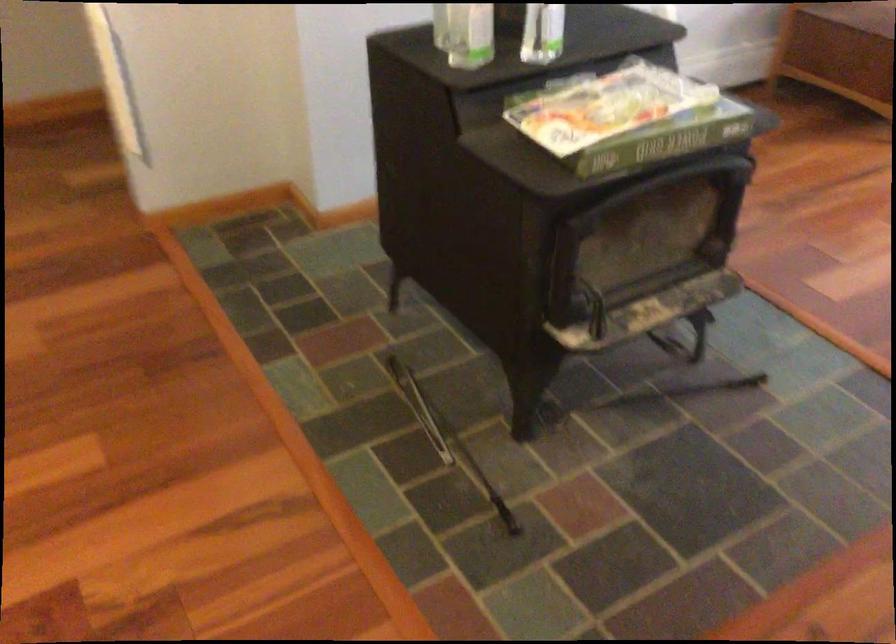
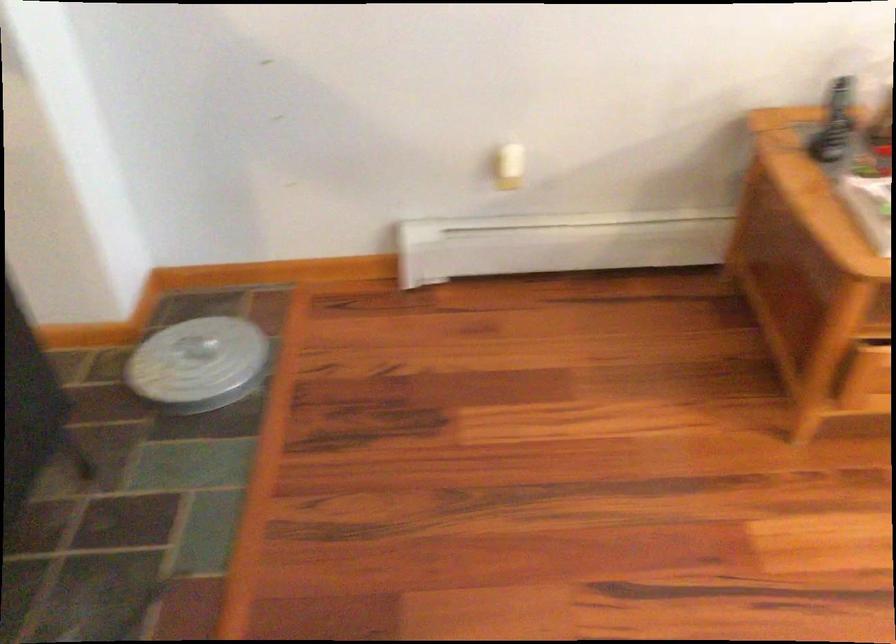
The images are taken continuously from a first-person perspective. In which direction are you moving?

The cameraman walked toward right, forward.